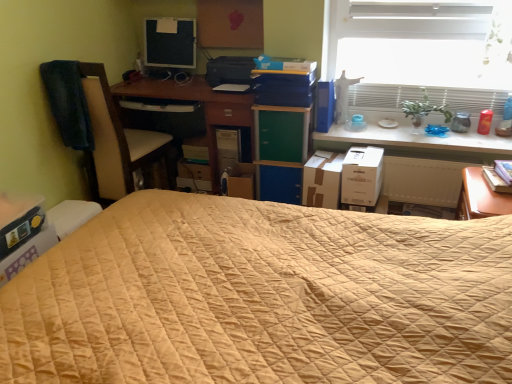
Locate an element on the screen. Image resolution: width=512 pixels, height=384 pixels. vacant area on top of brown cardboard box at center, which ranks as the 2th cardboard box in left-to-right order (from a real-world perspective) is located at coordinates (330, 157).